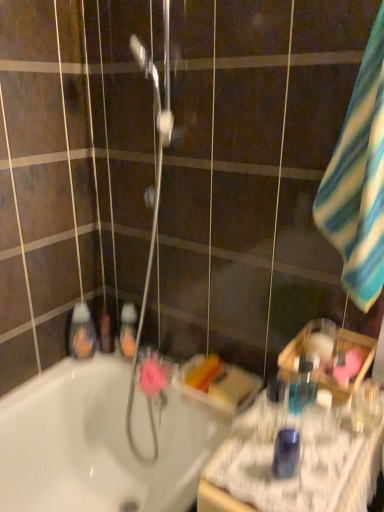
You are a GUI agent. You are given a task and a screenshot of the screen. Output one action in this format:
    pyautogui.click(x=<x>, y=<y>)
    Task: Click on the striped cotton towel at right
    Image resolution: width=384 pixels, height=512 pixels.
    Given the screenshot: What is the action you would take?
    pyautogui.click(x=359, y=181)

Locate an element on the screen. Image resolution: width=384 pixels, height=512 pixels. clear plastic bottle at right, marked as the second mouthwash in a front-to-back arrangement is located at coordinates (366, 406).

What is the approximate width of translucent plastic mouthwash at left, marked as the second mouthwash in a back-to-front arrangement?

translucent plastic mouthwash at left, marked as the second mouthwash in a back-to-front arrangement, is 1.96 inches in width.

I want to click on translucent plastic mouthwash at lower left, acting as the sixth mouthwash starting from the front, so click(x=105, y=329).

This screenshot has height=512, width=384. I want to click on translucent plastic basket at right, so click(x=299, y=466).

Considering the relative sizes of translucent plastic mouthwash at right, which ranks as the fourth mouthwash in back-to-front order, and clear plastic bottle at right, placed as the 1th mouthwash when sorted from right to left, in the image provided, is translucent plastic mouthwash at right, which ranks as the fourth mouthwash in back-to-front order, shorter than clear plastic bottle at right, placed as the 1th mouthwash when sorted from right to left,?

In fact, translucent plastic mouthwash at right, which ranks as the fourth mouthwash in back-to-front order, may be taller than clear plastic bottle at right, placed as the 1th mouthwash when sorted from right to left.

Consider the image. Which of these two, translucent plastic mouthwash at right, acting as the 5th mouthwash starting from the left, or clear plastic bottle at right, the 6th mouthwash in the left-to-right sequence, is bigger?

clear plastic bottle at right, the 6th mouthwash in the left-to-right sequence.

Is translucent plastic mouthwash at right, acting as the 5th mouthwash starting from the left, far from clear plastic bottle at right, the fifth mouthwash from the back?

That's not correct — translucent plastic mouthwash at right, acting as the 5th mouthwash starting from the left, is a little close to clear plastic bottle at right, the fifth mouthwash from the back.

How far apart are translucent plastic mouthwash at right, acting as the 5th mouthwash starting from the left, and clear plastic bottle at right, placed as the 1th mouthwash when sorted from right to left?

5.50 inches.

From the picture: Is translucent plastic mouthwash at lower left, acting as the sixth mouthwash starting from the front, not near clear plastic bottle at right, marked as the second mouthwash in a front-to-back arrangement?

That's not correct — translucent plastic mouthwash at lower left, acting as the sixth mouthwash starting from the front, is a little close to clear plastic bottle at right, marked as the second mouthwash in a front-to-back arrangement.

Which is behind, point (109, 344) or point (370, 382)?

The point (109, 344) is farther from the camera.

Find the location of `the 4th mouthwash positioned above the clear plastic bottle at right, the fifth mouthwash from the back (from the image's perspective)`. the 4th mouthwash positioned above the clear plastic bottle at right, the fifth mouthwash from the back (from the image's perspective) is located at coordinates (105, 329).

Is translucent plastic basket at right spatially inside striped cotton towel at right, or outside of it?

translucent plastic basket at right is not enclosed by striped cotton towel at right.

From a real-world perspective, which object stands above the other?

striped cotton towel at right.

Considering their positions, is translucent plastic basket at right located in front of or behind striped cotton towel at right?

Visually, translucent plastic basket at right is located in front of striped cotton towel at right.

Can you confirm if translucent plastic basket at right is shorter than striped cotton towel at right?

Correct, translucent plastic basket at right is not as tall as striped cotton towel at right.

Is translucent orange liquid at center, positioned as the third mouthwash in left-to-right order, a part of translucent plastic mouthwash at lower left, arranged as the 2th mouthwash when viewed from the left?

No, translucent orange liquid at center, positioned as the third mouthwash in left-to-right order, is not inside translucent plastic mouthwash at lower left, arranged as the 2th mouthwash when viewed from the left.

Is translucent plastic mouthwash at lower left, the 1th mouthwash in the back-to-front sequence, taller than translucent orange liquid at center, positioned as the third mouthwash in left-to-right order?

In fact, translucent plastic mouthwash at lower left, the 1th mouthwash in the back-to-front sequence, may be shorter than translucent orange liquid at center, positioned as the third mouthwash in left-to-right order.

How many degrees apart are the facing directions of translucent plastic mouthwash at lower left, acting as the sixth mouthwash starting from the front, and translucent orange liquid at center, positioned as the third mouthwash in left-to-right order?

5.39 degrees separate the facing orientations of translucent plastic mouthwash at lower left, acting as the sixth mouthwash starting from the front, and translucent orange liquid at center, positioned as the third mouthwash in left-to-right order.

In the scene shown: How far apart are translucent plastic mouthwash at lower left, which is the fifth mouthwash in right-to-left order, and translucent orange liquid at center, which is counted as the 4th mouthwash, starting from the front?

2.66 inches.

Can you tell me how much translucent plastic mouthwash at right, which ranks as the 2th mouthwash in right-to-left order, and striped cotton towel at right differ in facing direction?

They differ by 0.00673 degrees in their facing directions.

Is translucent plastic mouthwash at right, which ranks as the fourth mouthwash in back-to-front order, touching striped cotton towel at right?

They are not placed beside each other.

Based on their sizes in the image, would you say translucent plastic mouthwash at right, which ranks as the 2th mouthwash in right-to-left order, is bigger or smaller than striped cotton towel at right?

In the image, translucent plastic mouthwash at right, which ranks as the 2th mouthwash in right-to-left order, appears to be smaller than striped cotton towel at right.

From the image's perspective, is translucent plastic mouthwash at right, which ranks as the fourth mouthwash in back-to-front order, located above or below striped cotton towel at right?

Based on their image positions, translucent plastic mouthwash at right, which ranks as the fourth mouthwash in back-to-front order, is located beneath striped cotton towel at right.

Do you think blue plastic mouthwash at right, positioned as the fourth mouthwash in left-to-right order, is within clear plastic bottle at right, marked as the second mouthwash in a front-to-back arrangement, or outside of it?

blue plastic mouthwash at right, positioned as the fourth mouthwash in left-to-right order, is spatially situated outside clear plastic bottle at right, marked as the second mouthwash in a front-to-back arrangement.

Is blue plastic mouthwash at right, which is the 6th mouthwash from back to front, thinner than clear plastic bottle at right, marked as the second mouthwash in a front-to-back arrangement?

Yes, blue plastic mouthwash at right, which is the 6th mouthwash from back to front, is thinner than clear plastic bottle at right, marked as the second mouthwash in a front-to-back arrangement.

In terms of size, does blue plastic mouthwash at right, positioned as the fourth mouthwash in left-to-right order, appear bigger or smaller than clear plastic bottle at right, placed as the 1th mouthwash when sorted from right to left?

Considering their sizes, blue plastic mouthwash at right, positioned as the fourth mouthwash in left-to-right order, takes up less space than clear plastic bottle at right, placed as the 1th mouthwash when sorted from right to left.

Is blue plastic mouthwash at right, positioned as the third mouthwash in right-to-left order, closer to the viewer compared to clear plastic bottle at right, marked as the second mouthwash in a front-to-back arrangement?

Yes, blue plastic mouthwash at right, positioned as the third mouthwash in right-to-left order, is closer to the camera.

Is striped cotton towel at right turned away from translucent plastic mouthwash at right, which is counted as the 3th mouthwash, starting from the front?

No.

What's the angular difference between striped cotton towel at right and translucent plastic mouthwash at right, acting as the 5th mouthwash starting from the left,'s facing directions?

0.00673 degrees.

Does striped cotton towel at right touch translucent plastic mouthwash at right, which ranks as the fourth mouthwash in back-to-front order?

They are not placed beside each other.

From the image's perspective, is striped cotton towel at right positioned above or below translucent plastic mouthwash at right, which ranks as the fourth mouthwash in back-to-front order?

From the image's perspective, striped cotton towel at right appears above translucent plastic mouthwash at right, which ranks as the fourth mouthwash in back-to-front order.

You are a GUI agent. You are given a task and a screenshot of the screen. Output one action in this format:
    pyautogui.click(x=<x>, y=<y>)
    Task: Click on the 1st mouthwash positioned above the clear plastic bottle at right, the fifth mouthwash from the back (from a real-world perspective)
    
    Given the screenshot: What is the action you would take?
    pyautogui.click(x=303, y=384)

From the image's perspective, which mouthwash is the 4th one below the translucent plastic mouthwash at lower left, which is the fifth mouthwash in right-to-left order? Please provide its 2D coordinates.

[(366, 406)]

From the image, which object appears to be farther from translucent plastic mouthwash at left, arranged as the first mouthwash when viewed from the left, translucent plastic mouthwash at lower left, the 1th mouthwash in the back-to-front sequence, or translucent plastic basket at right?

translucent plastic basket at right.

Based on their spatial positions, is translucent orange liquid at center, positioned as the third mouthwash in left-to-right order, or translucent plastic mouthwash at lower left, acting as the sixth mouthwash starting from the front, further from translucent plastic mouthwash at left, marked as the second mouthwash in a back-to-front arrangement?

Based on the image, translucent orange liquid at center, positioned as the third mouthwash in left-to-right order, appears to be further to translucent plastic mouthwash at left, marked as the second mouthwash in a back-to-front arrangement.

When comparing their distances from blue plastic mouthwash at right, which is the 6th mouthwash from back to front, does striped cotton towel at right or translucent plastic mouthwash at lower left, which is the fifth mouthwash in right-to-left order, seem further?

The object further to blue plastic mouthwash at right, which is the 6th mouthwash from back to front, is translucent plastic mouthwash at lower left, which is the fifth mouthwash in right-to-left order.

From the image, which object appears to be nearer to translucent plastic mouthwash at left, the 5th mouthwash from the front, translucent plastic basket at right or translucent orange liquid at center, positioned as the third mouthwash in left-to-right order?

translucent orange liquid at center, positioned as the third mouthwash in left-to-right order, is positioned closer to the anchor translucent plastic mouthwash at left, the 5th mouthwash from the front.

When comparing their distances from striped cotton towel at right, does translucent plastic mouthwash at lower left, arranged as the 2th mouthwash when viewed from the left, or translucent plastic mouthwash at right, which is counted as the 3th mouthwash, starting from the front, seem further?

translucent plastic mouthwash at lower left, arranged as the 2th mouthwash when viewed from the left, is further to striped cotton towel at right.

From the image, which object appears to be nearer to translucent plastic mouthwash at lower left, acting as the sixth mouthwash starting from the front, striped cotton towel at right or translucent orange liquid at center, placed as the 3th mouthwash when sorted from back to front?

The object closer to translucent plastic mouthwash at lower left, acting as the sixth mouthwash starting from the front, is translucent orange liquid at center, placed as the 3th mouthwash when sorted from back to front.

Which object lies nearer to the anchor point translucent plastic mouthwash at right, acting as the 5th mouthwash starting from the left, translucent plastic mouthwash at left, the sixth mouthwash in the right-to-left sequence, or translucent orange liquid at center, positioned as the third mouthwash in left-to-right order?

Among the two, translucent orange liquid at center, positioned as the third mouthwash in left-to-right order, is located nearer to translucent plastic mouthwash at right, acting as the 5th mouthwash starting from the left.

Estimate the real-world distances between objects in this image. Which object is closer to translucent plastic mouthwash at left, arranged as the first mouthwash when viewed from the left, translucent orange liquid at center, the fourth mouthwash viewed from the right, or clear plastic bottle at right, marked as the second mouthwash in a front-to-back arrangement?

The object closer to translucent plastic mouthwash at left, arranged as the first mouthwash when viewed from the left, is translucent orange liquid at center, the fourth mouthwash viewed from the right.

The image size is (384, 512). Find the location of `mouthwash located between clear plastic bottle at right, the fifth mouthwash from the back, and translucent orange liquid at center, placed as the 3th mouthwash when sorted from back to front, in the depth direction`. mouthwash located between clear plastic bottle at right, the fifth mouthwash from the back, and translucent orange liquid at center, placed as the 3th mouthwash when sorted from back to front, in the depth direction is located at coordinates (303, 384).

The height and width of the screenshot is (512, 384). Find the location of `mouthwash between blue plastic mouthwash at right, the first mouthwash in the front-to-back sequence, and clear plastic bottle at right, marked as the second mouthwash in a front-to-back arrangement`. mouthwash between blue plastic mouthwash at right, the first mouthwash in the front-to-back sequence, and clear plastic bottle at right, marked as the second mouthwash in a front-to-back arrangement is located at coordinates (303, 384).

Where is `beach towel located between translucent plastic mouthwash at left, the 5th mouthwash from the front, and clear plastic bottle at right, placed as the 1th mouthwash when sorted from right to left, in the left-right direction`? beach towel located between translucent plastic mouthwash at left, the 5th mouthwash from the front, and clear plastic bottle at right, placed as the 1th mouthwash when sorted from right to left, in the left-right direction is located at coordinates (359, 181).

The height and width of the screenshot is (512, 384). In order to click on beach towel between translucent plastic basket at right and translucent plastic mouthwash at left, marked as the second mouthwash in a back-to-front arrangement, in the front-back direction in this screenshot , I will do `click(359, 181)`.